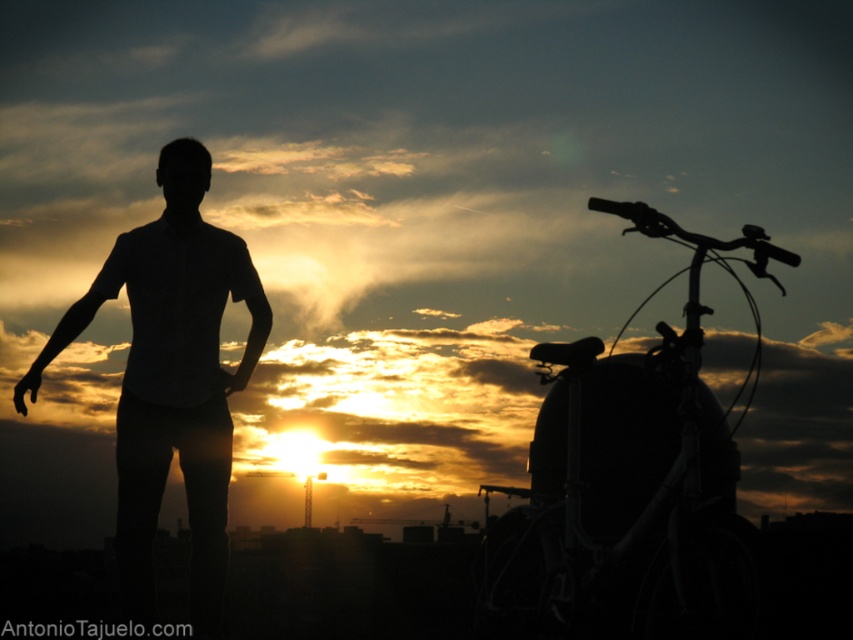
Consider the image. You are standing in the scene and want to walk from the point at coordinates point (x=723, y=588) to the point at coordinates point (x=131, y=486). Which direction should you face to move towards the second point?

To move from point (x=723, y=588) to point (x=131, y=486), you should face towards the lower left direction since the second point is located to the left and lower in the coordinate system.

You are planning to take a photo of the silhouette figure at center and the silhouette metallic bicycle at right. If the bicycle is wider than the figure, how should you position your camera to ensure both are fully in frame?

Since the silhouette metallic bicycle at right might be wider than the silhouette figure at center, you should position your camera to focus on the wider silhouette metallic bicycle at right to ensure both subjects are fully captured in the frame.